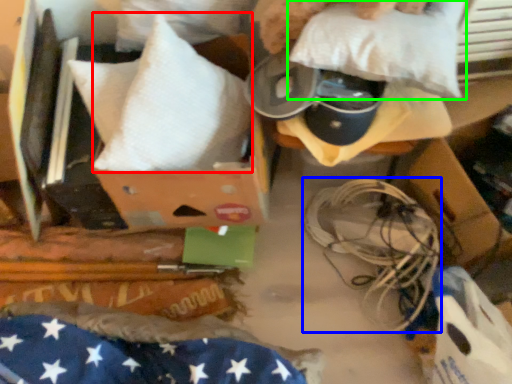
Question: Estimate the real-world distances between objects in this image. Which object is closer to pillow (highlighted by a red box), wire (highlighted by a blue box) or pillow (highlighted by a green box)?

Choices:
 (A) wire
 (B) pillow

Answer: (B)